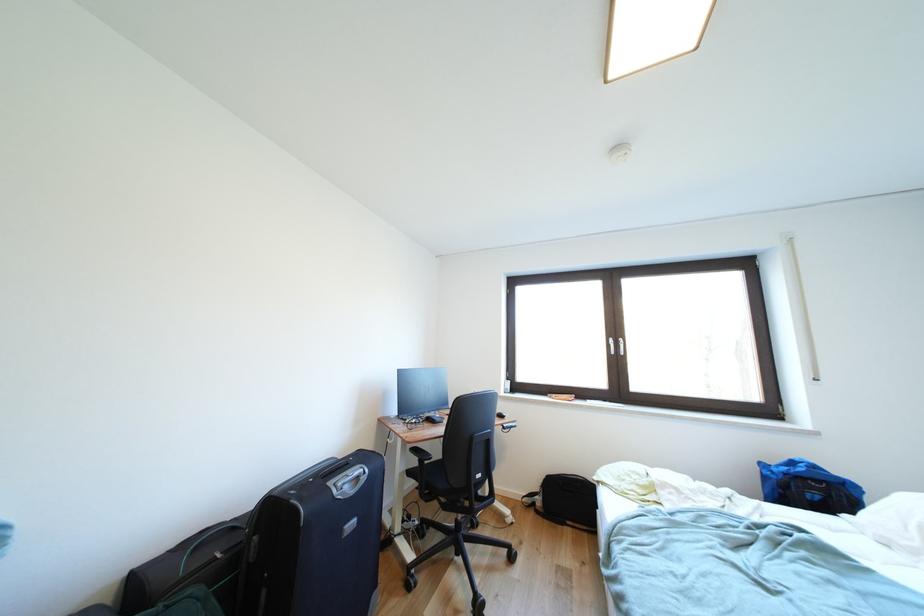
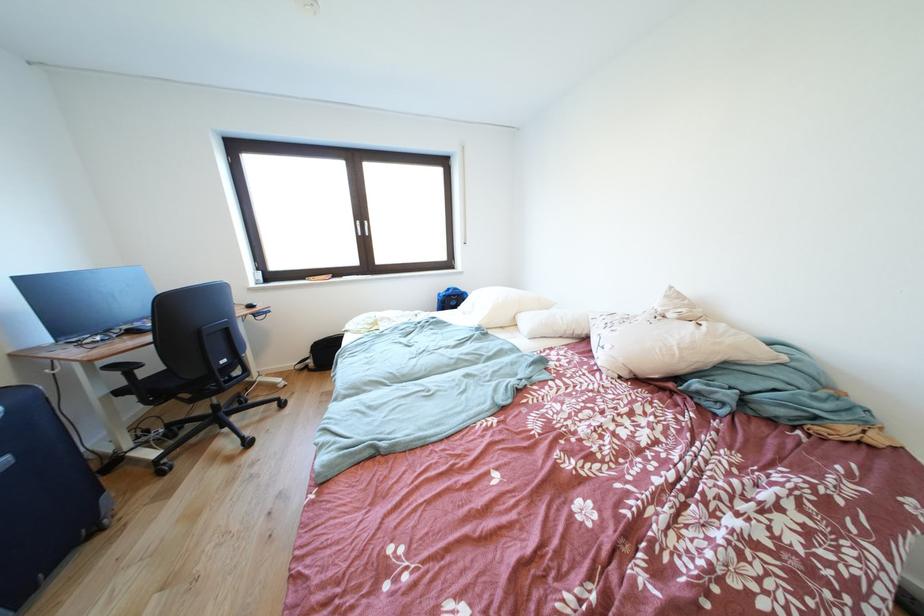
Find the pixel in the second image that matches point 542,508 in the first image.

(315, 371)